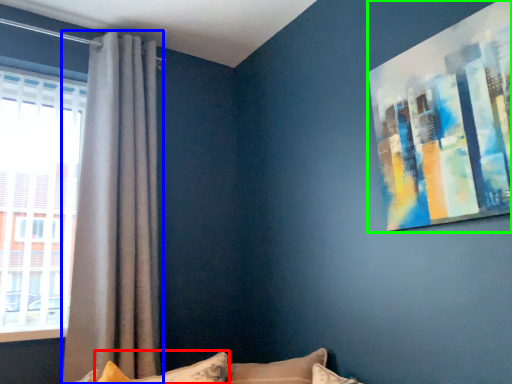
Question: Which object is the farthest from pillow (highlighted by a red box)? Choose among these: curtain (highlighted by a blue box) or picture frame (highlighted by a green box).

Choices:
 (A) curtain
 (B) picture frame

Answer: (B)